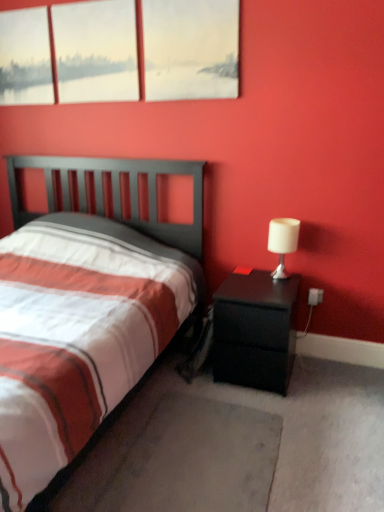
Find the location of a particular element. Image resolution: width=384 pixels, height=512 pixels. matte white canvas at upper left, the third window viewed from the right is located at coordinates (25, 57).

The image size is (384, 512). I want to click on gray carpet at lower center, so click(x=180, y=460).

Identify the location of window that appears behind the matte glass window at upper left, arranged as the second window when viewed from the right. (25, 57).

Considering the sizes of objects matte white canvas at upper left, the 1th window viewed from the left, and matte glass window at upper left, arranged as the second window when viewed from the right, in the image provided, who is wider, matte white canvas at upper left, the 1th window viewed from the left, or matte glass window at upper left, arranged as the second window when viewed from the right,?

matte glass window at upper left, arranged as the second window when viewed from the right, is wider.

From a real-world perspective, does matte white canvas at upper left, the third window viewed from the right, sit lower than matte glass window at upper left, which is counted as the second window, starting from the left?

Yes.

How distant is matte white canvas at upper left, the 1th window viewed from the left, from matte glass window at upper left, arranged as the second window when viewed from the right?

A distance of 11.67 inches exists between matte white canvas at upper left, the 1th window viewed from the left, and matte glass window at upper left, arranged as the second window when viewed from the right.

Which is in front, black matte nightstand at right or matte white painting at upper center, arranged as the first window when viewed from the right?

black matte nightstand at right.

Considering the positions of point (228, 283) and point (231, 82), is point (228, 283) closer or farther from the camera than point (231, 82)?

Point (228, 283).

Is black matte nightstand at right taller than matte white painting at upper center, which is counted as the third window, starting from the left?

No, black matte nightstand at right is not taller than matte white painting at upper center, which is counted as the third window, starting from the left.

Does black matte nightstand at right have a lesser width compared to matte white painting at upper center, arranged as the first window when viewed from the right?

In fact, black matte nightstand at right might be wider than matte white painting at upper center, arranged as the first window when viewed from the right.

Is gray carpet at lower center positioned beyond the bounds of matte white painting at upper center, which is counted as the third window, starting from the left?

Yes, gray carpet at lower center is located beyond the bounds of matte white painting at upper center, which is counted as the third window, starting from the left.

Where is `concrete beneath the matte white painting at upper center, which is counted as the third window, starting from the left (from a real-world perspective)`? concrete beneath the matte white painting at upper center, which is counted as the third window, starting from the left (from a real-world perspective) is located at coordinates (180, 460).

Based on their sizes in the image, would you say gray carpet at lower center is bigger or smaller than matte white painting at upper center, arranged as the first window when viewed from the right?

In the image, gray carpet at lower center appears to be larger than matte white painting at upper center, arranged as the first window when viewed from the right.

From the image's perspective, which object appears higher, gray carpet at lower center or matte white painting at upper center, which is counted as the third window, starting from the left?

From the image's view, matte white painting at upper center, which is counted as the third window, starting from the left, is above.

Between black matte nightstand at right and gray carpet at lower center, which one has smaller size?

gray carpet at lower center.

Are black matte nightstand at right and gray carpet at lower center located far from each other?

They are positioned close to each other.

Is black matte nightstand at right taller or shorter than gray carpet at lower center?

In the image, black matte nightstand at right appears to be taller than gray carpet at lower center.

How different are the orientations of black matte nightstand at right and gray carpet at lower center in degrees?

There is a 91.6-degree angle between the facing directions of black matte nightstand at right and gray carpet at lower center.

From the image's perspective, is matte white canvas at upper left, the 1th window viewed from the left, positioned above or below matte white painting at upper center, arranged as the first window when viewed from the right?

From the image's perspective, matte white canvas at upper left, the 1th window viewed from the left, appears above matte white painting at upper center, arranged as the first window when viewed from the right.

Considering the positions of objects matte white canvas at upper left, the 1th window viewed from the left, and matte white painting at upper center, arranged as the first window when viewed from the right, in the image provided, who is more to the left, matte white canvas at upper left, the 1th window viewed from the left, or matte white painting at upper center, arranged as the first window when viewed from the right,?

From the viewer's perspective, matte white canvas at upper left, the 1th window viewed from the left, appears more on the left side.

Is matte white canvas at upper left, the 1th window viewed from the left, facing away from matte white painting at upper center, which is counted as the third window, starting from the left?

That's not correct — matte white canvas at upper left, the 1th window viewed from the left, is not looking away from matte white painting at upper center, which is counted as the third window, starting from the left.

Considering the relative positions of matte white canvas at upper left, the 1th window viewed from the left, and white matte table lamp at right in the image provided, is matte white canvas at upper left, the 1th window viewed from the left, to the right of white matte table lamp at right from the viewer's perspective?

Incorrect, matte white canvas at upper left, the 1th window viewed from the left, is not on the right side of white matte table lamp at right.

Locate an element on the screen. This screenshot has height=512, width=384. the 2nd window behind the white matte table lamp at right is located at coordinates (25, 57).

How many degrees apart are the facing directions of matte white canvas at upper left, the 1th window viewed from the left, and white matte table lamp at right?

The angular difference between matte white canvas at upper left, the 1th window viewed from the left, and white matte table lamp at right is 1.47 degrees.

Which is less distant, (44, 58) or (272, 277)?

Clearly, point (44, 58) is more distant from the camera than point (272, 277).

Is the position of matte white painting at upper center, which is counted as the third window, starting from the left, more distant than that of matte white canvas at upper left, the third window viewed from the right?

No, matte white painting at upper center, which is counted as the third window, starting from the left, is closer to the viewer.

In the scene shown: Is matte white painting at upper center, which is counted as the third window, starting from the left, facing towards matte white canvas at upper left, the third window viewed from the right?

No.

From the image's perspective, which object appears higher, matte white painting at upper center, which is counted as the third window, starting from the left, or matte white canvas at upper left, the 1th window viewed from the left?

matte white canvas at upper left, the 1th window viewed from the left, is shown above in the image.

What are the coordinates of `the 2nd window behind the matte white painting at upper center, which is counted as the third window, starting from the left` in the screenshot? It's located at click(25, 57).

Locate an element on the screen. window above the matte white canvas at upper left, the third window viewed from the right (from a real-world perspective) is located at coordinates (96, 51).

This screenshot has height=512, width=384. There is a black matte nightstand at right. In order to click on the 1st window above it (from the image's perspective) in this screenshot , I will do `click(191, 49)`.

Based on the photo, looking at the image, which one is located further to matte white painting at upper center, arranged as the first window when viewed from the right, matte white canvas at upper left, the 1th window viewed from the left, or white matte table lamp at right?

Among the two, white matte table lamp at right is located further to matte white painting at upper center, arranged as the first window when viewed from the right.

Looking at the image, which one is located further to gray carpet at lower center, matte white painting at upper center, arranged as the first window when viewed from the right, or white matte table lamp at right?

matte white painting at upper center, arranged as the first window when viewed from the right, lies further to gray carpet at lower center than the other object.

Which object lies nearer to the anchor point matte glass window at upper left, arranged as the second window when viewed from the right, white matte table lamp at right or black matte nightstand at right?

The object closer to matte glass window at upper left, arranged as the second window when viewed from the right, is white matte table lamp at right.

When comparing their distances from gray carpet at lower center, does matte glass window at upper left, which is counted as the second window, starting from the left, or white matte table lamp at right seem closer?

white matte table lamp at right is closer to gray carpet at lower center.

When comparing their distances from matte white canvas at upper left, the 1th window viewed from the left, does matte white painting at upper center, which is counted as the third window, starting from the left, or gray carpet at lower center seem further?

gray carpet at lower center.

Looking at the image, which one is located closer to matte white canvas at upper left, the 1th window viewed from the left, white matte table lamp at right or black matte nightstand at right?

white matte table lamp at right is positioned closer to the anchor matte white canvas at upper left, the 1th window viewed from the left.

Estimate the real-world distances between objects in this image. Which object is closer to matte glass window at upper left, arranged as the second window when viewed from the right, black matte nightstand at right or white matte table lamp at right?

The object closer to matte glass window at upper left, arranged as the second window when viewed from the right, is white matte table lamp at right.

From the image, which object appears to be farther from matte glass window at upper left, which is counted as the second window, starting from the left, matte white canvas at upper left, the third window viewed from the right, or black matte nightstand at right?

black matte nightstand at right.

The image size is (384, 512). What are the coordinates of `table lamp between matte white canvas at upper left, the third window viewed from the right, and gray carpet at lower center, in the vertical direction` in the screenshot? It's located at pyautogui.click(x=282, y=242).

The image size is (384, 512). I want to click on table lamp between matte white painting at upper center, arranged as the first window when viewed from the right, and black matte nightstand at right vertically, so click(x=282, y=242).

Identify the location of nightstand that lies between matte white canvas at upper left, the third window viewed from the right, and gray carpet at lower center from top to bottom. This screenshot has width=384, height=512. pyautogui.click(x=255, y=330).

You are a GUI agent. You are given a task and a screenshot of the screen. Output one action in this format:
    pyautogui.click(x=<x>, y=<y>)
    Task: Click on the table lamp between matte glass window at upper left, arranged as the second window when viewed from the right, and gray carpet at lower center vertically
    Image resolution: width=384 pixels, height=512 pixels.
    Given the screenshot: What is the action you would take?
    pyautogui.click(x=282, y=242)